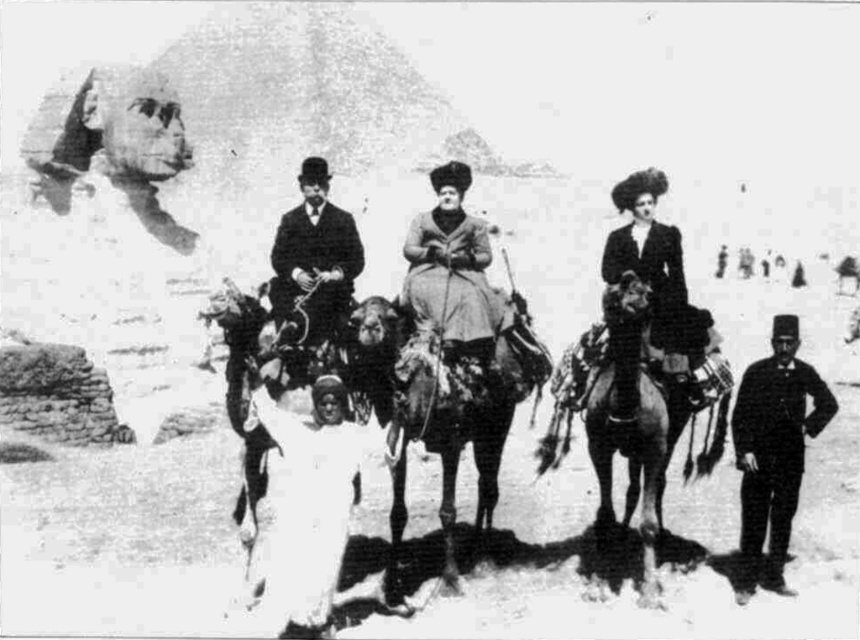
Is point (590, 442) closer to camera compared to point (668, 241)?

Yes, it is in front of point (668, 241).

Is point (607, 342) farther from camera compared to point (636, 268)?

No.

Between point (642, 440) and point (602, 256), which one is positioned in front?

Point (642, 440) is more forward.

Identify the location of dark brown leather horse at center. (625, 417).

Between point (478, 520) and point (409, 225), which one is positioned in front?

Positioned in front is point (478, 520).

Does smooth brown horse at center have a larger size compared to coarse woolen coat at center?

Correct, smooth brown horse at center is larger in size than coarse woolen coat at center.

This screenshot has width=860, height=640. I want to click on smooth brown horse at center, so click(x=461, y=422).

Which is in front, point (446, 344) or point (654, 186)?

Point (446, 344) is in front.

Is point (459, 202) closer to viewer compared to point (664, 381)?

That is False.

This screenshot has width=860, height=640. Describe the element at coordinates (449, 276) in the screenshot. I see `coarse woolen coat at center` at that location.

Find the location of a particular element. coarse woolen coat at center is located at coordinates (449, 276).